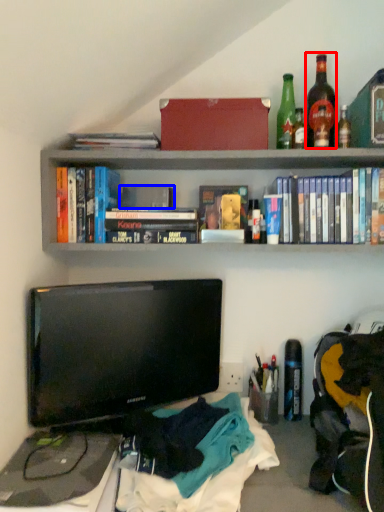
Question: Which object is further to the camera taking this photo, bottle (highlighted by a red box) or paperback book (highlighted by a blue box)?

Choices:
 (A) bottle
 (B) paperback book

Answer: (B)